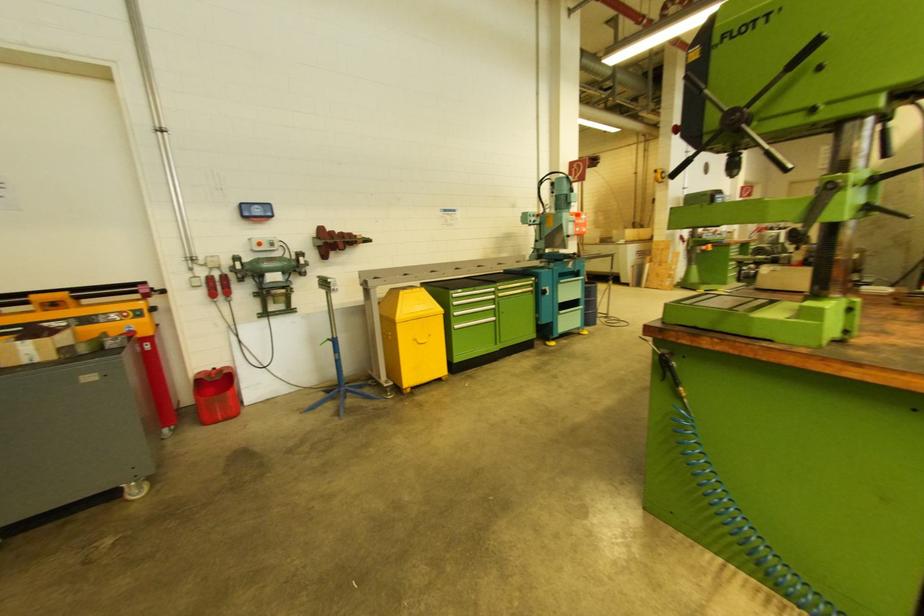
The width and height of the screenshot is (924, 616). Describe the element at coordinates (543, 292) in the screenshot. I see `a blue cabinet handle` at that location.